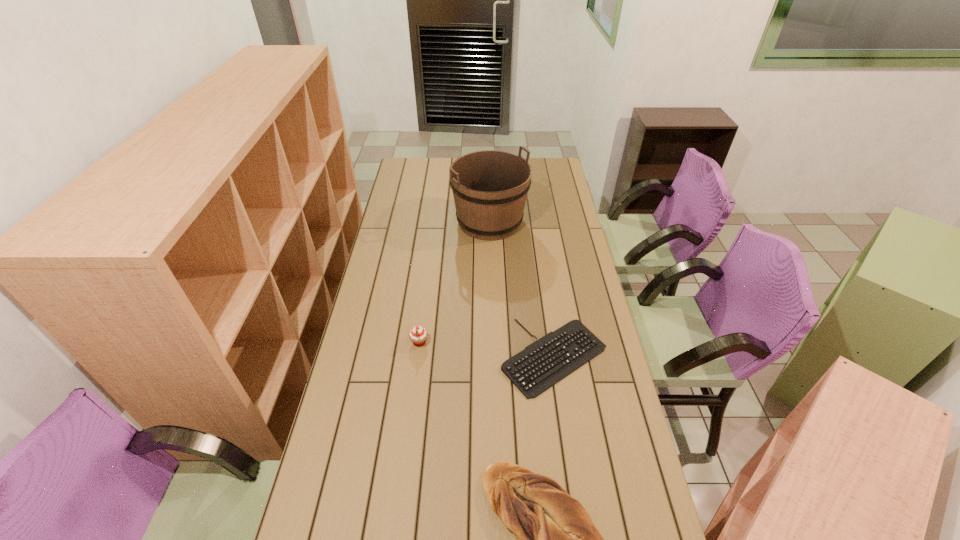
Where is `the farthest object`? The image size is (960, 540). the farthest object is located at coordinates (490, 187).

I want to click on the tallest object, so click(490, 187).

The image size is (960, 540). Find the location of `cupcake`. cupcake is located at coordinates (418, 335).

Locate an element on the screen. The image size is (960, 540). the second tallest object is located at coordinates (418, 335).

Find the location of a particular element. Image resolution: width=960 pixels, height=540 pixels. the shortest object is located at coordinates point(548,360).

Where is `free space located on the back of the farthest object`? Image resolution: width=960 pixels, height=540 pixels. free space located on the back of the farthest object is located at coordinates click(x=489, y=170).

This screenshot has width=960, height=540. Identify the location of free space located 0.050m on the back of the leftmost object. (421, 324).

This screenshot has height=540, width=960. Identify the location of free space located on the left of the computer keyboard. (389, 356).

Find the location of `object positioned at the right edge`. object positioned at the right edge is located at coordinates (548, 360).

Find the location of a particular element. The image size is (960, 540). vacant space at the left edge of the desktop is located at coordinates (388, 260).